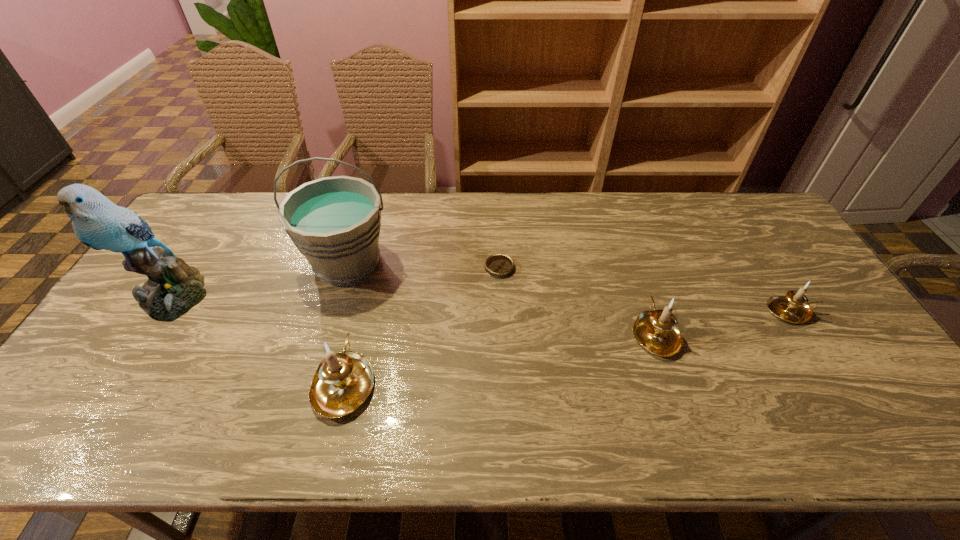
Select which object is the third closest to the second object from right to left. Please provide its 2D coordinates. Your answer should be formatted as a tuple, i.e. [(x, y)], where the tuple contains the x and y coordinates of a point satisfying the conditions above.

[(343, 381)]

You are a GUI agent. You are given a task and a screenshot of the screen. Output one action in this format:
    pyautogui.click(x=<x>, y=<y>)
    Task: Click on the object that stands as the fourth closest to the compass
    The height and width of the screenshot is (540, 960).
    Given the screenshot: What is the action you would take?
    pyautogui.click(x=794, y=307)

Identify the location of candle holder that stands as the closest to the bucket. The height and width of the screenshot is (540, 960). (343, 381).

Image resolution: width=960 pixels, height=540 pixels. In order to click on candle holder that stands as the third closest to the leftmost object in this screenshot , I will do `click(794, 307)`.

The image size is (960, 540). Find the location of `free space in the image that satisfies the following two spatial constraints: 1. on the handle side of the third tallest object; 2. on the left side of the shortest object`. free space in the image that satisfies the following two spatial constraints: 1. on the handle side of the third tallest object; 2. on the left side of the shortest object is located at coordinates [372, 268].